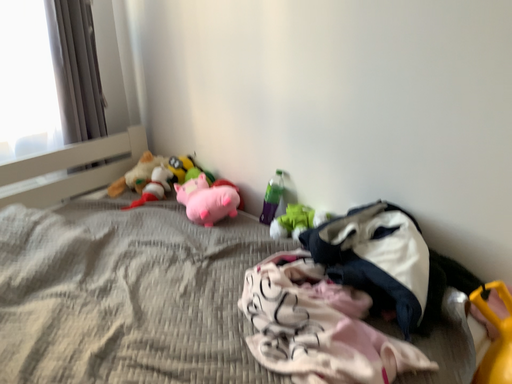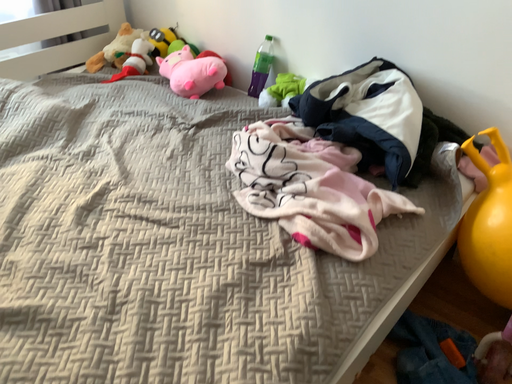
Question: How did the camera likely rotate when shooting the video?

Choices:
 (A) rotated upward
 (B) rotated downward

Answer: (B)